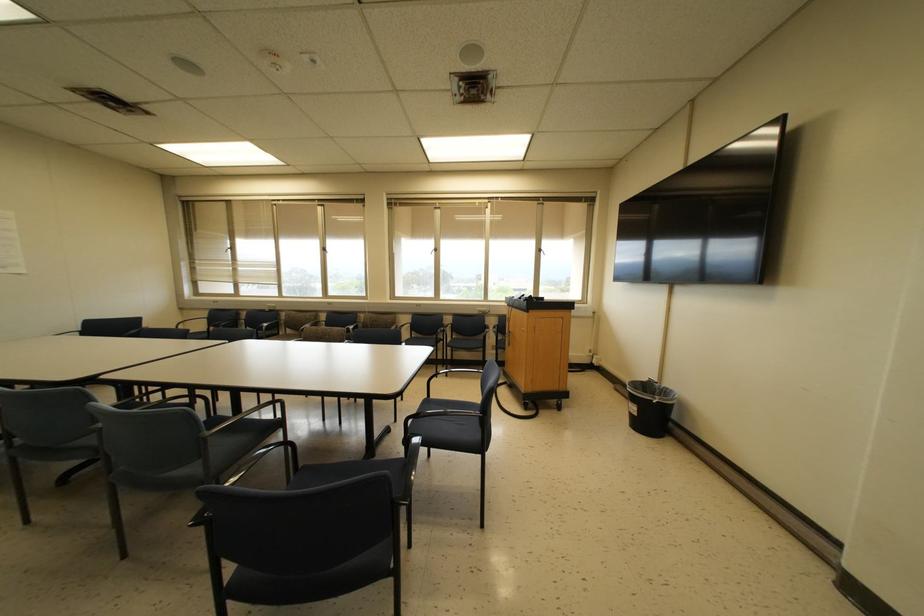
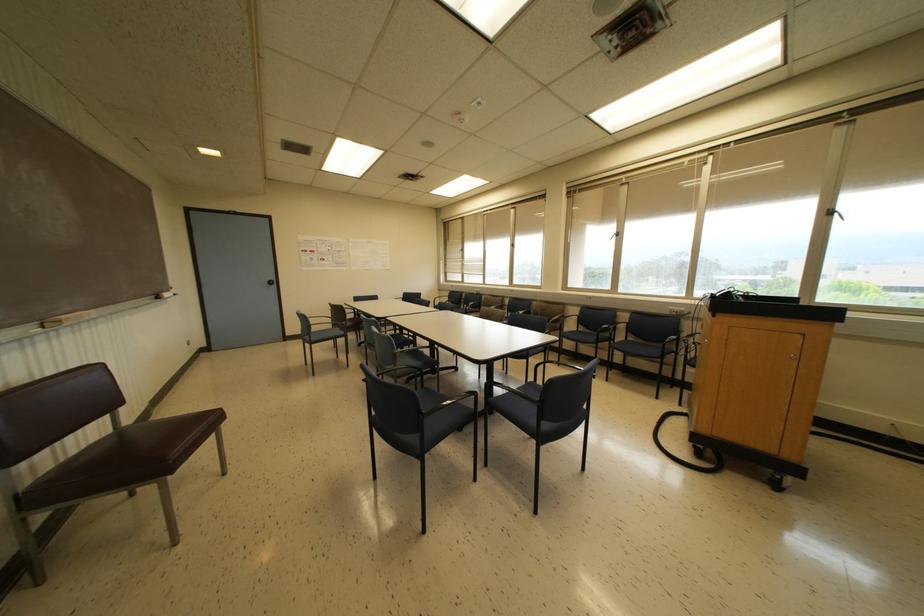
The point at [538,249] is marked in the first image. Where is the corresponding point in the second image?

(827, 213)